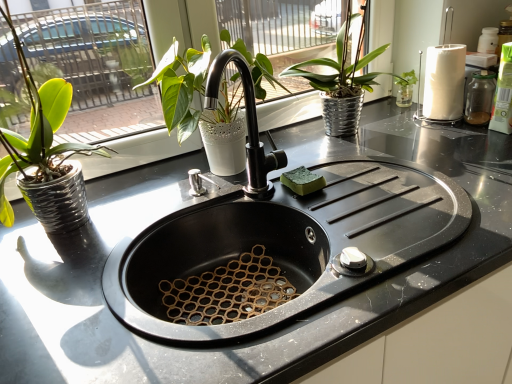
Question: Can you confirm if metallic silver pot at upper center, positioned as the 3th houseplant in left-to-right order, is thinner than matte white pot at upper center, the 2th houseplant when ordered from right to left?

Choices:
 (A) yes
 (B) no

Answer: (B)

Question: From the image's perspective, is metallic silver pot at upper center, which is the first houseplant from right to left, located above matte white pot at upper center, marked as the 2th houseplant in a left-to-right arrangement?

Choices:
 (A) yes
 (B) no

Answer: (A)

Question: From a real-world perspective, is metallic silver pot at upper center, which is the first houseplant from right to left, positioned over matte white pot at upper center, marked as the 2th houseplant in a left-to-right arrangement, based on gravity?

Choices:
 (A) yes
 (B) no

Answer: (A)

Question: From the image's perspective, does metallic silver pot at upper center, which is the first houseplant from right to left, appear lower than matte white pot at upper center, marked as the 2th houseplant in a left-to-right arrangement?

Choices:
 (A) no
 (B) yes

Answer: (A)

Question: Can you confirm if metallic silver pot at upper center, which is the first houseplant from right to left, is smaller than matte white pot at upper center, marked as the 2th houseplant in a left-to-right arrangement?

Choices:
 (A) no
 (B) yes

Answer: (A)

Question: From a real-world perspective, relative to matte white pot at upper center, marked as the 2th houseplant in a left-to-right arrangement, is green matte plant at left, placed as the third houseplant when sorted from right to left, vertically above or below?

Choices:
 (A) above
 (B) below

Answer: (A)

Question: Is green matte plant at left, placed as the 1th houseplant when sorted from left to right, taller or shorter than matte white pot at upper center, the 2th houseplant when ordered from right to left?

Choices:
 (A) tall
 (B) short

Answer: (A)

Question: Is green matte plant at left, placed as the third houseplant when sorted from right to left, bigger or smaller than matte white pot at upper center, the 2th houseplant when ordered from right to left?

Choices:
 (A) big
 (B) small

Answer: (A)

Question: Is green matte plant at left, placed as the third houseplant when sorted from right to left, in front of or behind matte white pot at upper center, the 2th houseplant when ordered from right to left, in the image?

Choices:
 (A) behind
 (B) front

Answer: (B)

Question: From the image's perspective, is metallic silver pot at upper center, positioned as the 3th houseplant in left-to-right order, positioned above or below green matte plant at left, placed as the third houseplant when sorted from right to left?

Choices:
 (A) above
 (B) below

Answer: (A)

Question: Relative to green matte plant at left, placed as the third houseplant when sorted from right to left, is metallic silver pot at upper center, which is the first houseplant from right to left, in front or behind?

Choices:
 (A) front
 (B) behind

Answer: (B)

Question: Is point (358, 89) closer or farther from the camera than point (4, 201)?

Choices:
 (A) closer
 (B) farther

Answer: (B)

Question: Considering the positions of metallic silver pot at upper center, positioned as the 3th houseplant in left-to-right order, and green matte plant at left, placed as the third houseplant when sorted from right to left, in the image, is metallic silver pot at upper center, positioned as the 3th houseplant in left-to-right order, bigger or smaller than green matte plant at left, placed as the third houseplant when sorted from right to left,?

Choices:
 (A) small
 (B) big

Answer: (B)

Question: Based on their sizes in the image, would you say green matte plant at left, placed as the 1th houseplant when sorted from left to right, is bigger or smaller than metallic silver pot at upper center, which is the first houseplant from right to left?

Choices:
 (A) big
 (B) small

Answer: (B)

Question: Is green matte plant at left, placed as the third houseplant when sorted from right to left, taller or shorter than metallic silver pot at upper center, which is the first houseplant from right to left?

Choices:
 (A) tall
 (B) short

Answer: (A)